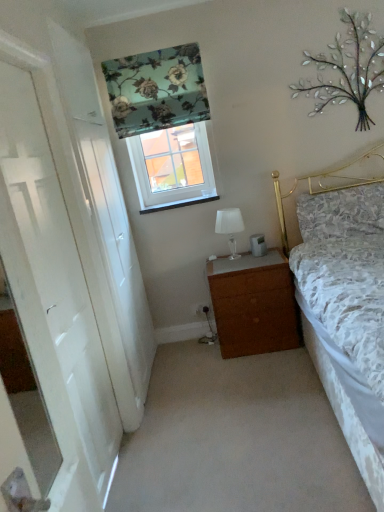
Find the location of a particular element. vacant area on top of floral fabric curtain at upper center (from a real-world perspective) is located at coordinates (139, 45).